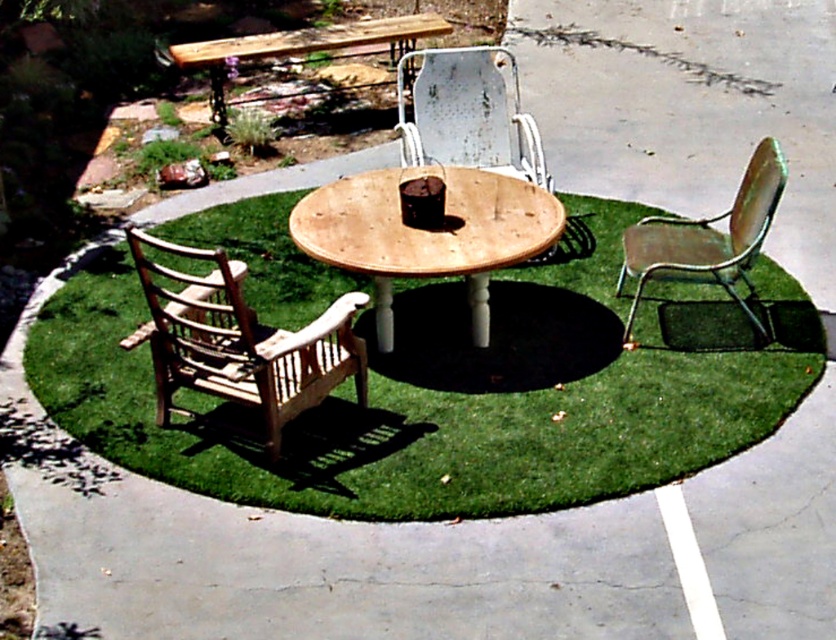
Can you confirm if natural wood table at center is wider than rusty metal chair at center?

Yes.

Is natural wood table at center shorter than rusty metal chair at center?

In fact, natural wood table at center may be taller than rusty metal chair at center.

Is point (444, 232) less distant than point (410, 92)?

That is True.

Locate an element on the screen. This screenshot has width=836, height=640. natural wood table at center is located at coordinates (427, 232).

Is light brown wooden chair at lower left shorter than rusty metal chair at center?

Incorrect, light brown wooden chair at lower left's height does not fall short of rusty metal chair at center's.

Which is below, light brown wooden chair at lower left or rusty metal chair at center?

light brown wooden chair at lower left is below.

Which is in front, point (286, 406) or point (511, 118)?

Positioned in front is point (286, 406).

What are the coordinates of `light brown wooden chair at lower left` in the screenshot? It's located at (238, 342).

Does point (506, 445) come in front of point (431, 70)?

Yes, point (506, 445) is closer to viewer.

Who is more distant from viewer, (381, 372) or (449, 97)?

The point (449, 97) is more distant.

The height and width of the screenshot is (640, 836). Find the location of `green artificial grass at center`. green artificial grass at center is located at coordinates (459, 390).